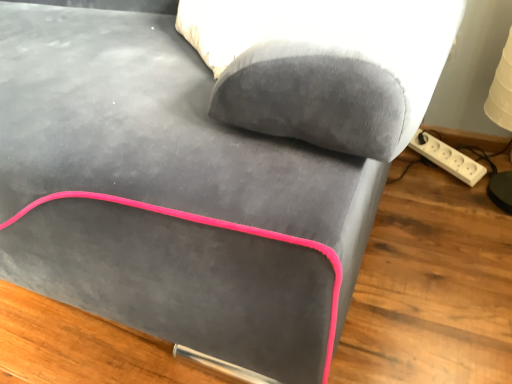
This screenshot has height=384, width=512. What do you see at coordinates (324, 66) in the screenshot?
I see `velvet gray bean bag at upper center` at bounding box center [324, 66].

Find the location of a particular element. velvet gray bean bag at upper center is located at coordinates (324, 66).

The image size is (512, 384). Identify the location of velvet gray bean bag at upper center. (324, 66).